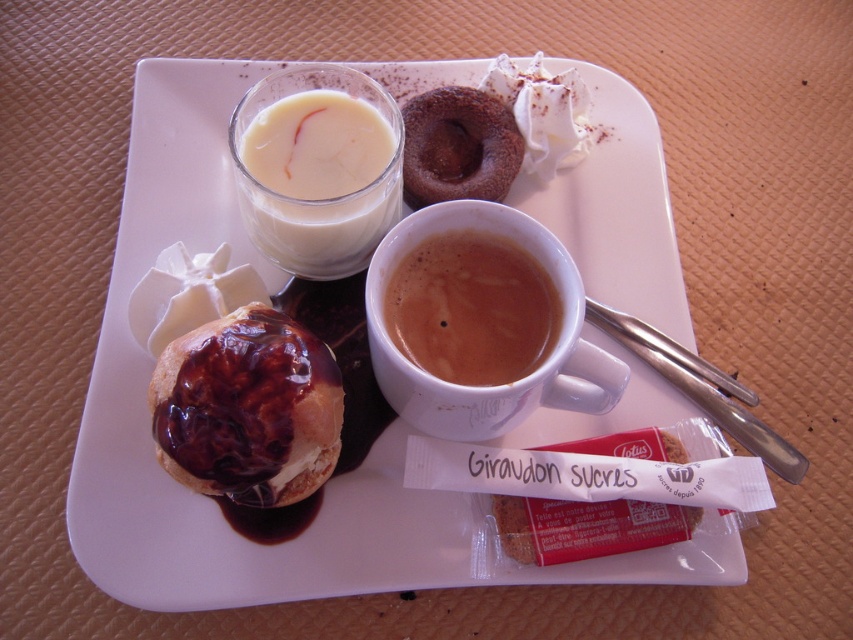
Which of these two, matte white tray at center or chocolate cake at upper center, stands shorter?

chocolate cake at upper center

Which is below, matte white tray at center or chocolate cake at upper center?

matte white tray at center

The image size is (853, 640). Describe the element at coordinates (329, 480) in the screenshot. I see `matte white tray at center` at that location.

Where is `matte white tray at center`? This screenshot has width=853, height=640. matte white tray at center is located at coordinates (329, 480).

Is chocolate glazed pastry at lower left thinner than chocolate cake at upper center?

In fact, chocolate glazed pastry at lower left might be wider than chocolate cake at upper center.

Who is positioned more to the right, chocolate glazed pastry at lower left or chocolate cake at upper center?

From the viewer's perspective, chocolate cake at upper center appears more on the right side.

Locate an element on the screen. chocolate glazed pastry at lower left is located at coordinates (247, 408).

Can you confirm if brown matte cup at center is positioned above white creamy liquid at upper left?

Incorrect, brown matte cup at center is not positioned above white creamy liquid at upper left.

Does brown matte cup at center have a smaller size compared to white creamy liquid at upper left?

Yes.

Who is more distant from viewer, (491, 314) or (236, 180)?

The point (236, 180) is more distant.

Identify the location of brown matte cup at center. (473, 308).